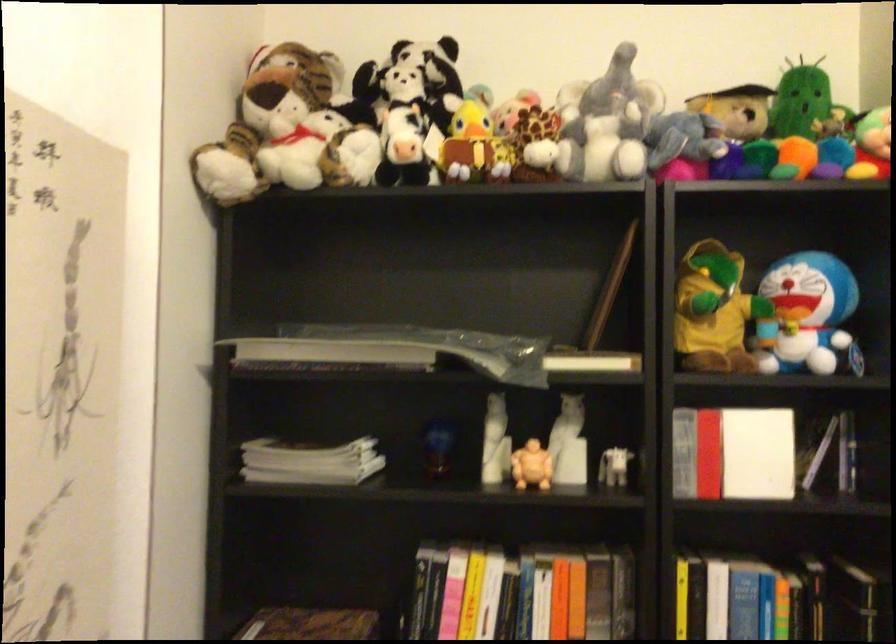
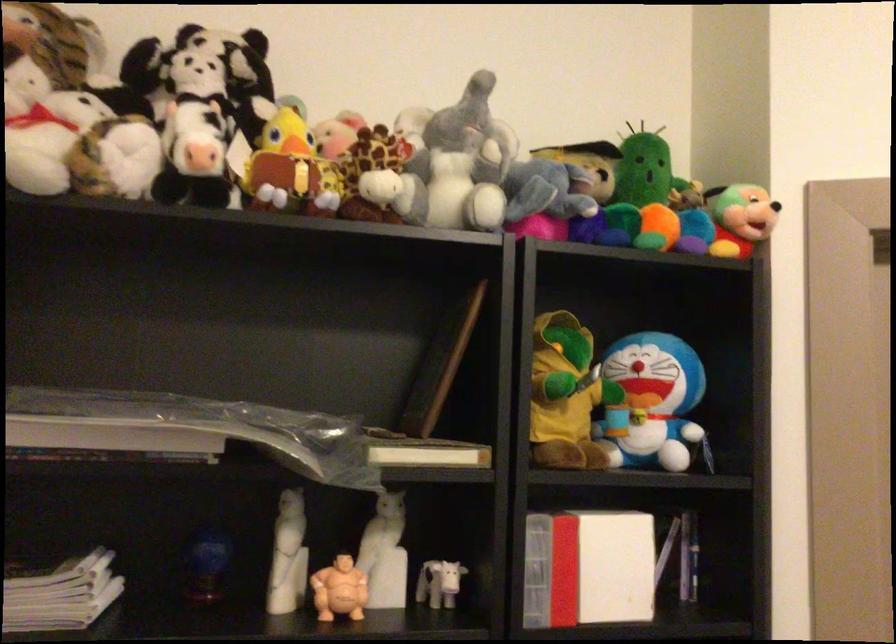
Question: The camera is either moving clockwise (left) or counter-clockwise (right) around the object. The first image is from the beginning of the video and the second image is from the end. Is the camera moving left or right when shooting the video?

Choices:
 (A) Left
 (B) Right

Answer: (A)